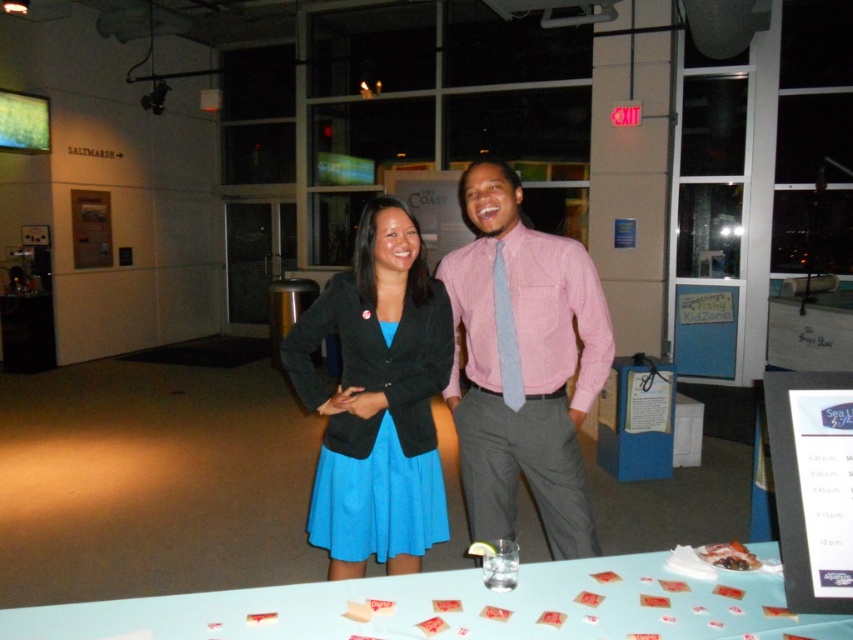
You are a photographer taking a portrait of the two people in the scene. You notice the pink checkered shirt at center and the light blue textured tie at center. Which clothing item should you focus on more to ensure it stands out in the photo?

The pink checkered shirt at center is larger in size than the light blue textured tie at center, so focusing on the pink checkered shirt at center will ensure it stands out more in the photo.

In the scene shown: You are standing at the point marked by the coordinates point (686, 579) in a modern building with large glass windows and doors. You want to greet someone who is standing 1.43 meters away from you. Can you estimate how far you are from the person you want to greet?

The point (686, 579) and the viewer are 1.43 meters apart, so you are 1.43 meters away from the person you want to greet.

You are a photographer setting up for an event. You need to decide which item, the blue fabric dress at center or the light blue textured tie at center, requires a wider focus area in your camera. Based on their sizes, which one should you adjust your focus for?

The blue fabric dress at center requires a wider focus area because its width surpasses that of the light blue textured tie at center.